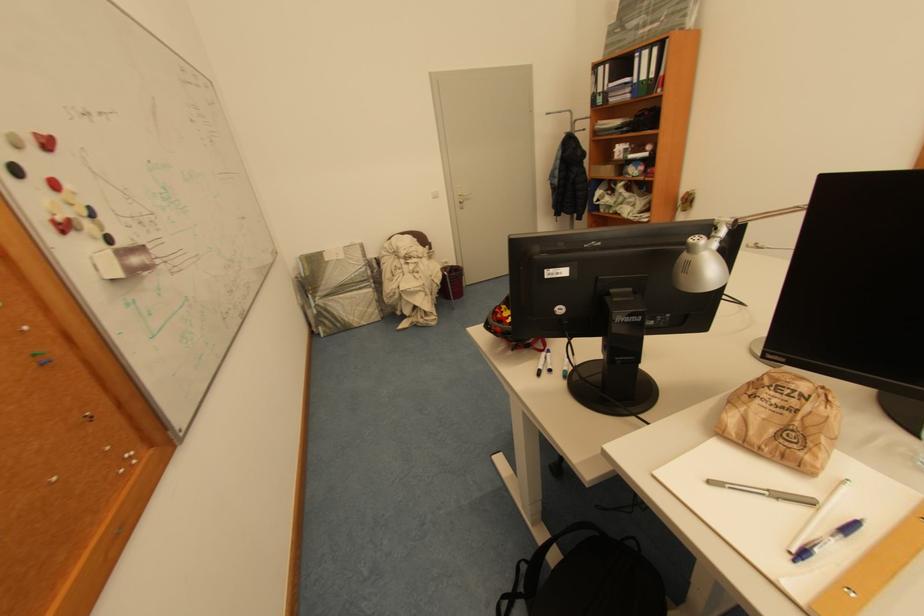
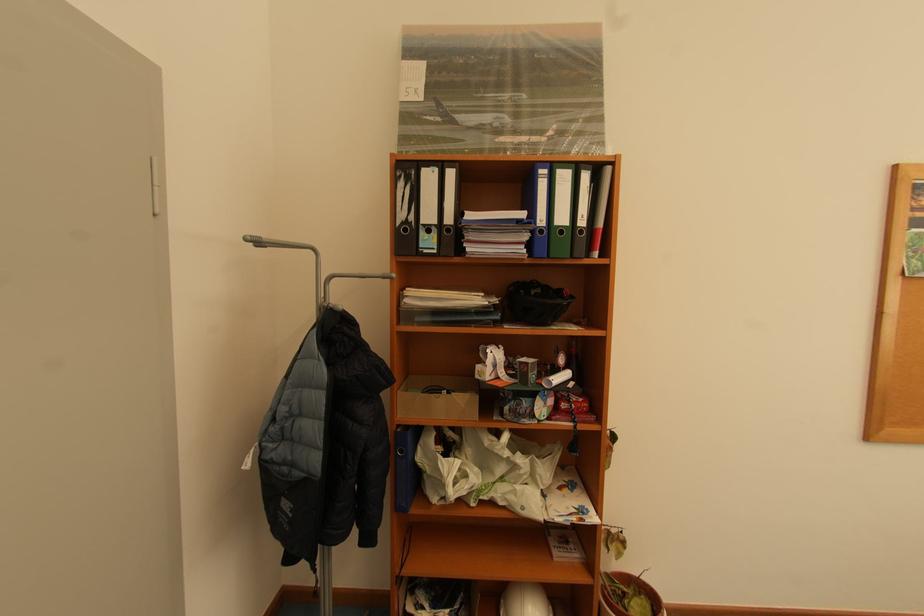
Where in the second image is the point corresponding to point (646, 55) from the first image?

(552, 172)